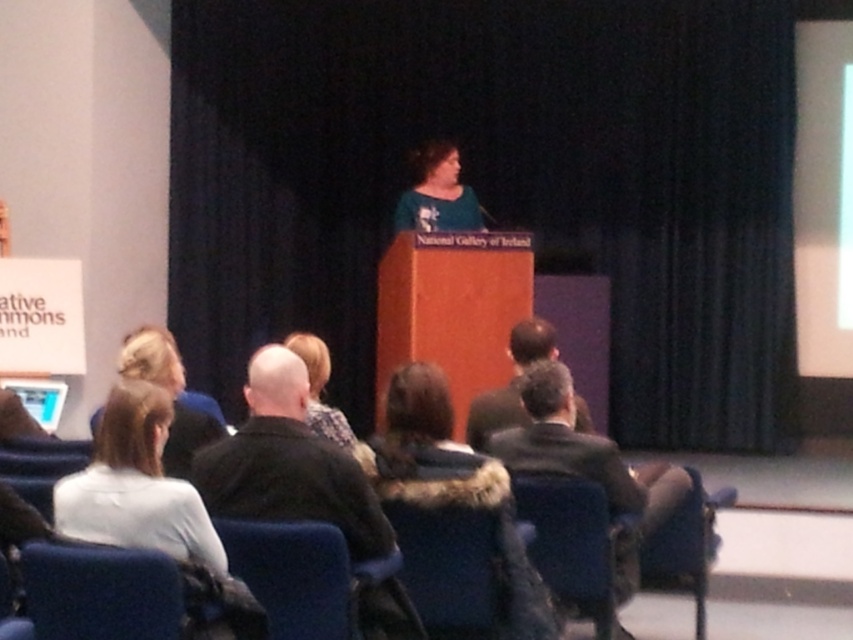
You are an event organizer and need to seat two VIP guests in the front row. The VIP guests have requested chairs that are the same type. You have the blue fabric chair at lower center and the velvet blue chair at lower center available. Which chair type should you choose to ensure both guests get chairs of the same size?

The blue fabric chair at lower center is smaller than the velvet blue chair at lower center. To ensure both VIP guests have chairs of the same size, you should choose the velvet blue chair at lower center for both since they are larger and more likely to be uniform in size.

You are an event organizer checking the seating arrangement. You have a small package that needs to be placed on either the dark blue fabric chair at lower left or the dark brown leather jacket at center. Which object can accommodate the package without it falling off due to size constraints?

The dark brown leather jacket at center is larger, so placing the small package there would be more stable and less likely to fall off compared to the smaller dark blue fabric chair at lower left.

You are an event planner who needs to place a 1.5 meter wide banner between the dark blue fabric chair at lower left and the dark brown leather jacket at center. Is there enough space for the banner?

The dark blue fabric chair at lower left and dark brown leather jacket at center are 1.84 meters apart from each other, so yes, the banner can be placed between them since the distance is greater than the banner width.